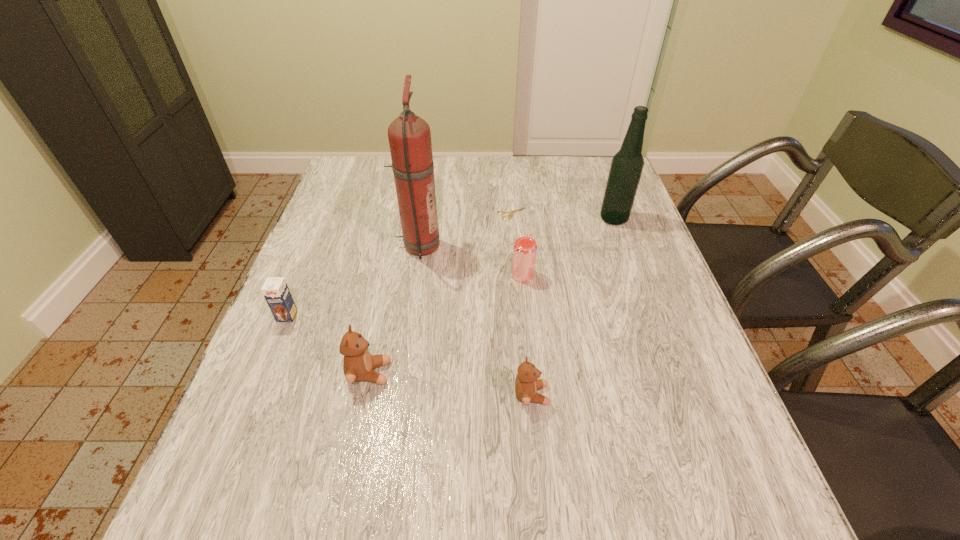
The image size is (960, 540). Identify the location of free spot at the far edge of the desktop. [x=384, y=194].

You are a GUI agent. You are given a task and a screenshot of the screen. Output one action in this format:
    pyautogui.click(x=<x>, y=<y>)
    Task: Click on the vacant space at the near edge of the desktop
    
    Given the screenshot: What is the action you would take?
    pyautogui.click(x=467, y=441)

In the image, there is a desktop. Where is `vacant space at the left edge`? The width and height of the screenshot is (960, 540). vacant space at the left edge is located at coordinates (302, 384).

The width and height of the screenshot is (960, 540). I want to click on vacant space at the right edge of the desktop, so click(x=647, y=334).

Where is `vacant area that lies between the shorter teddy bear and the rightmost object`? This screenshot has height=540, width=960. vacant area that lies between the shorter teddy bear and the rightmost object is located at coordinates (572, 307).

Identify the location of blank region between the sixth shortest object and the shears. The width and height of the screenshot is (960, 540). (564, 217).

You are a GUI agent. You are given a task and a screenshot of the screen. Output one action in this format:
    pyautogui.click(x=<x>, y=<y>)
    Task: Click on the free space between the beer can and the rightmost object
    
    Given the screenshot: What is the action you would take?
    pyautogui.click(x=568, y=247)

The height and width of the screenshot is (540, 960). What are the coordinates of `blank region between the alcohol and the shorter teddy bear` in the screenshot? It's located at (572, 307).

Find the location of a particular element. free area in between the shortest object and the third farthest object is located at coordinates (466, 230).

This screenshot has height=540, width=960. Identify the location of vacant space that's between the shorter teddy bear and the chocolate milk. (409, 355).